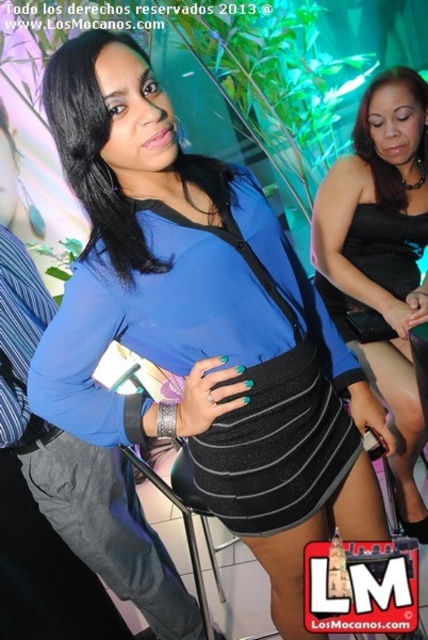
Does black matte skirt at center come in front of matte blue top at center?

No, it is behind matte blue top at center.

Is black matte skirt at center bigger than matte blue top at center?

Yes.

Locate an element on the screen. black matte skirt at center is located at coordinates (213, 356).

Where is `black matte skirt at center`? The image size is (428, 640). black matte skirt at center is located at coordinates (213, 356).

Between black satin dress at center and matte blue top at center, which one is positioned lower?

black satin dress at center is lower down.

Is black satin dress at center positioned before matte blue top at center?

No, black satin dress at center is behind matte blue top at center.

In the scene shown: Measure the distance between black satin dress at center and camera.

A distance of 1.64 meters exists between black satin dress at center and camera.

I want to click on black satin dress at center, so click(382, 259).

Between black matte skirt at center and black satin dress at center, which one appears on the left side from the viewer's perspective?

From the viewer's perspective, black matte skirt at center appears more on the left side.

Does black matte skirt at center appear on the left side of black satin dress at center?

Indeed, black matte skirt at center is positioned on the left side of black satin dress at center.

Describe the element at coordinates (213, 356) in the screenshot. I see `black matte skirt at center` at that location.

I want to click on black matte skirt at center, so click(213, 356).